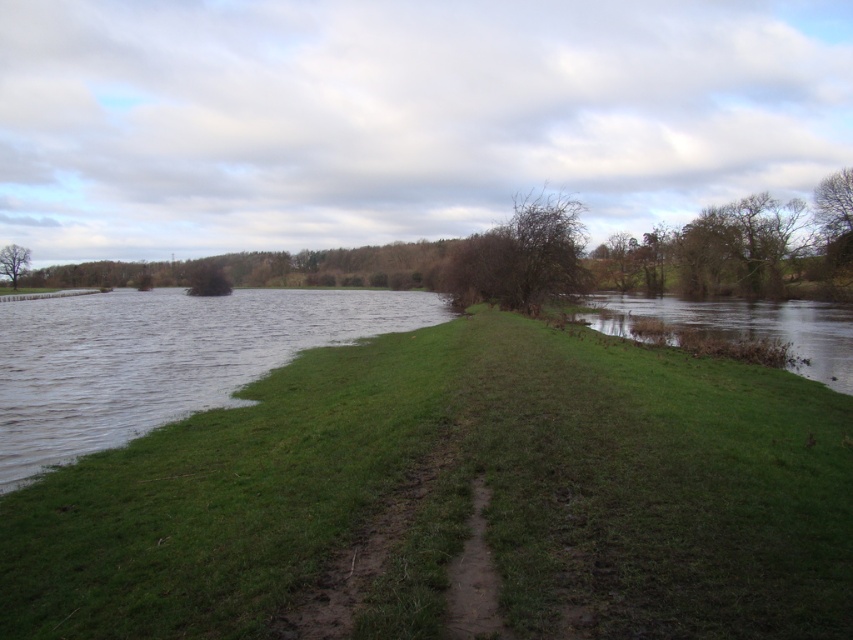
Question: Is bare branches at upper right further to camera compared to green leafy tree at left?

Choices:
 (A) yes
 (B) no

Answer: (B)

Question: Which point is farther to the camera?

Choices:
 (A) clear water at lower left
 (B) green grassy at center

Answer: (A)

Question: Can you confirm if green grassy at center is smaller than green grassy river at right?

Choices:
 (A) yes
 (B) no

Answer: (A)

Question: Which point is farther from the camera taking this photo?

Choices:
 (A) (498, 248)
 (B) (840, 244)
 (C) (790, 336)

Answer: (B)

Question: Among these objects, which one is farthest from the camera?

Choices:
 (A) brown leafless tree at center
 (B) bare branches at upper right
 (C) clear water at lower left

Answer: (B)

Question: Is clear water at lower left positioned at the back of green leafy tree at left?

Choices:
 (A) no
 (B) yes

Answer: (A)